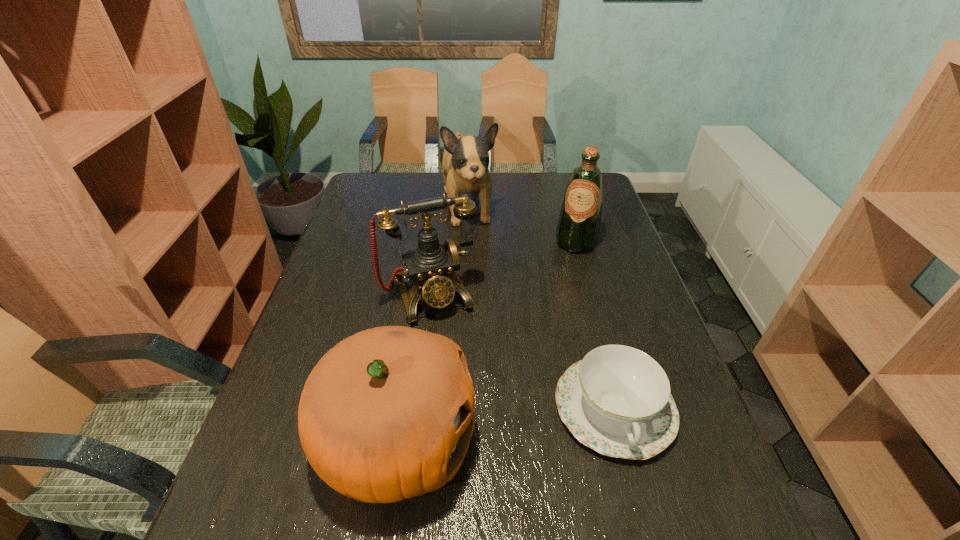
You are a GUI agent. You are given a task and a screenshot of the screen. Output one action in this format:
    pyautogui.click(x=<x>, y=<y>)
    Task: Click on the free space on the desktop that is between the pumpkin and the chinaware and is positioned at the face of the puppy
    Image resolution: width=960 pixels, height=540 pixels.
    Given the screenshot: What is the action you would take?
    pyautogui.click(x=528, y=421)

Where is `vacant space on the desktop that is between the pumpkin and the shortest object and is positioned on the front-facing side of the olive oil`? This screenshot has width=960, height=540. vacant space on the desktop that is between the pumpkin and the shortest object and is positioned on the front-facing side of the olive oil is located at coordinates (515, 423).

Where is `free space on the desktop that is between the pumpkin and the chinaware and is positioned on the front of the telephone, featuring the rotary dial`? This screenshot has height=540, width=960. free space on the desktop that is between the pumpkin and the chinaware and is positioned on the front of the telephone, featuring the rotary dial is located at coordinates (481, 428).